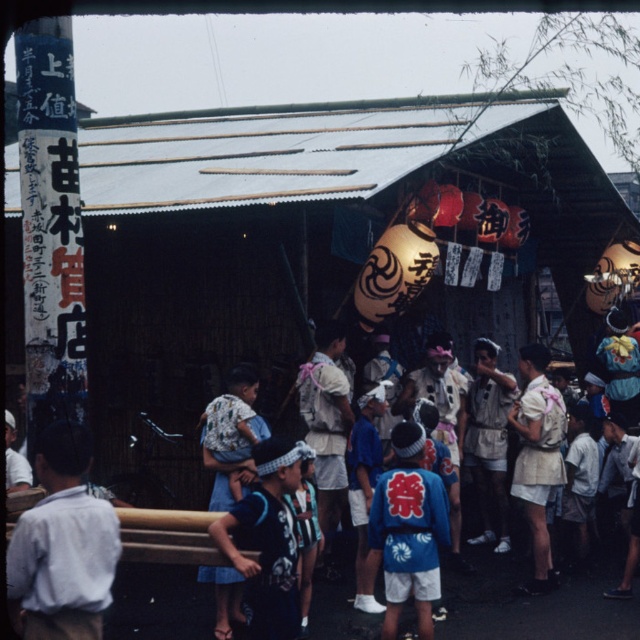
You are a festival attendee standing at the entrance of the pavilion. You see the wooden hut at center and the white cotton shirt at left. Which object is closer to you?

The white cotton shirt at left is closer to you because the wooden hut at center is positioned over it, indicating it is further away.

You are attending a traditional Japanese festival and notice two participants wearing the white cotton shirt at left and the blue fabric kimono at center. Which participant is shorter?

The white cotton shirt at left is shorter than the blue fabric kimono at center, so the participant wearing the white cotton shirt at left is shorter.